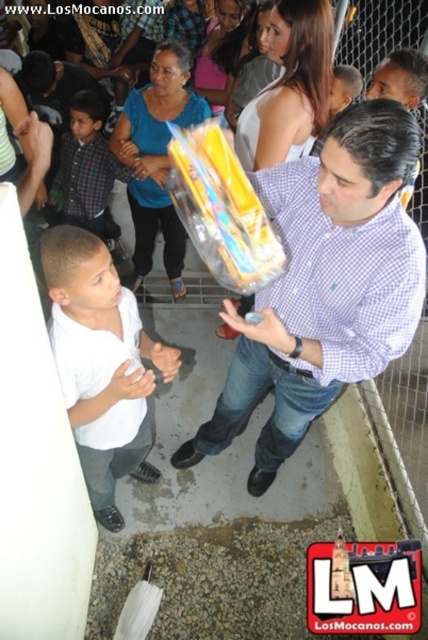
Question: Does matte plastic toy at center appear over plaid fabric shirt at left?

Choices:
 (A) yes
 (B) no

Answer: (B)

Question: Which object is the farthest from the white matte shirt at lower left?

Choices:
 (A) matte plastic toy at center
 (B) plaid fabric shirt at left

Answer: (B)

Question: Which object appears closest to the camera in this image?

Choices:
 (A) white matte shirt at lower left
 (B) plaid fabric shirt at left
 (C) matte plastic toy at center

Answer: (C)

Question: Which of the following is the closest to the observer?

Choices:
 (A) (372, 257)
 (B) (67, 179)
 (C) (127, 467)

Answer: (A)

Question: Is matte plastic toy at center behind plaid fabric shirt at left?

Choices:
 (A) no
 (B) yes

Answer: (A)

Question: Where is white matte shirt at lower left located in relation to plaid fabric shirt at left in the image?

Choices:
 (A) right
 (B) left

Answer: (A)